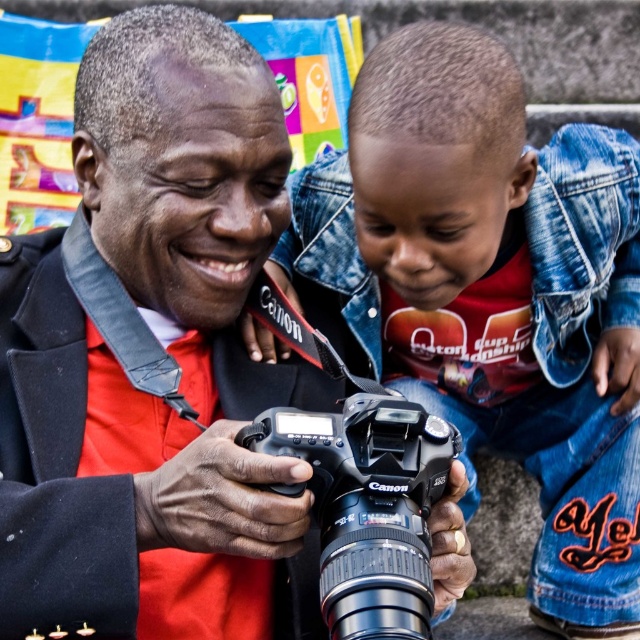
Consider the image. You are taking a photo with the Canon camera shown in the scene. You want to focus on the point that is closer to the camera. Which point should you choose between point (113, 275) and point (316, 488)?

Point (316, 488) is closer to the camera than point (113, 275), so you should focus on point (316, 488).

You are a photographer trying to frame a shot of the denim jacket at center and the black plastic camera at center. Which object should you adjust your focus on if you want to capture the wider one in your frame?

The denim jacket at center might be wider than black plastic camera at center, so you should focus on the denim jacket at center to capture the wider object in your frame.